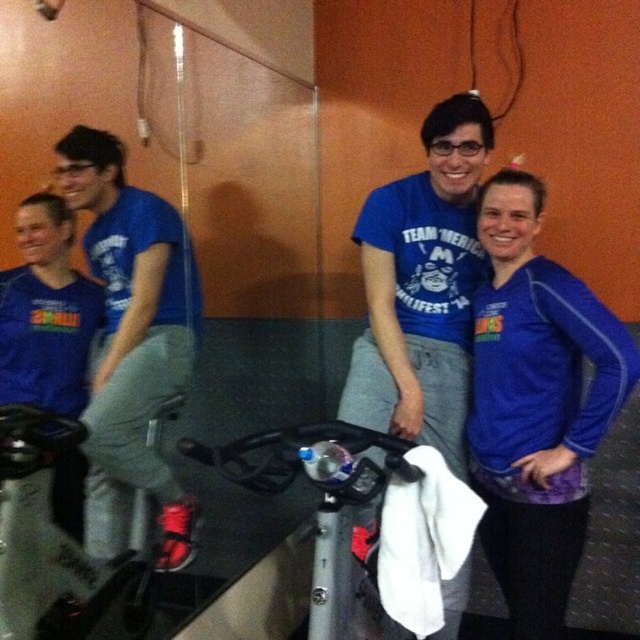
Does point (179, 364) come farther from viewer compared to point (10, 529)?

Yes, it is behind point (10, 529).

Is point (129, 282) more distant than point (38, 509)?

Yes.

In order to click on blue t-shirt at left in this screenshot , I will do `click(134, 323)`.

Is point (45, 634) positioned in front of point (358, 465)?

No, it is not.

Who is lower down, metallic silver bicycle at lower left or silver metallic bicycle at center?

metallic silver bicycle at lower left is below.

Does point (36, 452) come closer to viewer compared to point (282, 452)?

No, it is behind (282, 452).

In order to click on metallic silver bicycle at lower left in this screenshot , I will do `click(44, 532)`.

Identify the location of blue matte long-sleeve shirt at center-right. (536, 404).

Does point (532, 515) come in front of point (296, 448)?

No, (532, 515) is further to viewer.

Where is `blue matte long-sleeve shirt at center-right`? The width and height of the screenshot is (640, 640). blue matte long-sleeve shirt at center-right is located at coordinates (536, 404).